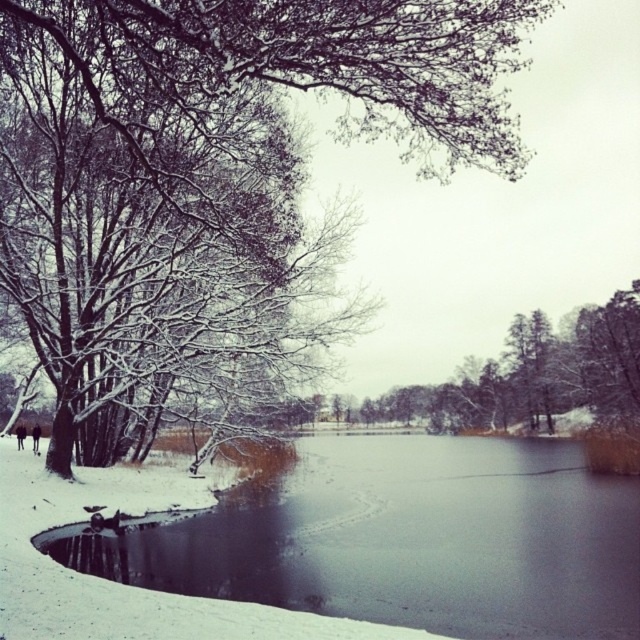
Question: Can you confirm if smooth ice lake at lower left is positioned below green matte tree at center?

Choices:
 (A) no
 (B) yes

Answer: (B)

Question: Among these objects, which one is nearest to the camera?

Choices:
 (A) green matte tree at center
 (B) dark brown leather boots at lower left
 (C) dark brown fur coat at lower left
 (D) snow-covered branches at upper left

Answer: (D)

Question: Is green matte tree at center to the right of dark brown fur coat at lower left from the viewer's perspective?

Choices:
 (A) no
 (B) yes

Answer: (B)

Question: Can you confirm if snow-covered branches at upper left is positioned to the left of dark brown fur coat at lower left?

Choices:
 (A) yes
 (B) no

Answer: (B)

Question: Which of the following is the farthest from the observer?

Choices:
 (A) (81, 38)
 (B) (552, 342)
 (C) (19, 432)

Answer: (B)

Question: Among these objects, which one is nearest to the camera?

Choices:
 (A) snow-covered branches at upper left
 (B) dark brown leather boots at lower left

Answer: (A)